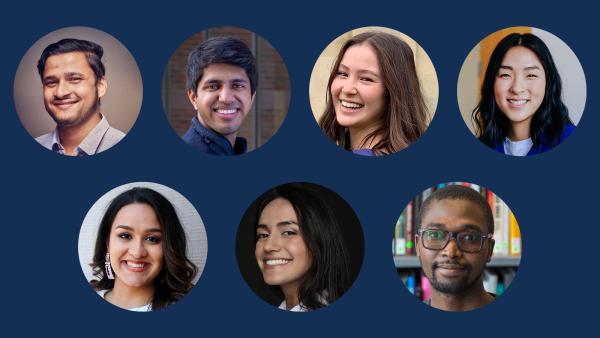
In order to click on space between circular photos in this screenshot , I will do `click(151, 92)`, `click(298, 89)`, `click(447, 90)`, `click(220, 245)`, `click(376, 246)`.